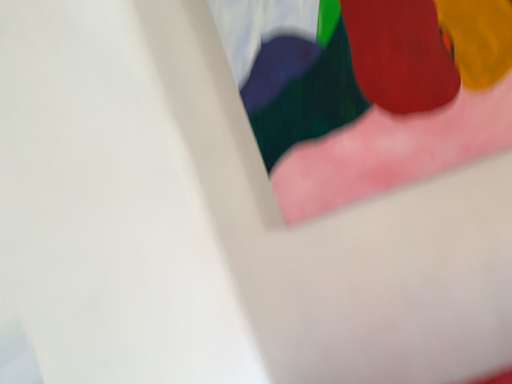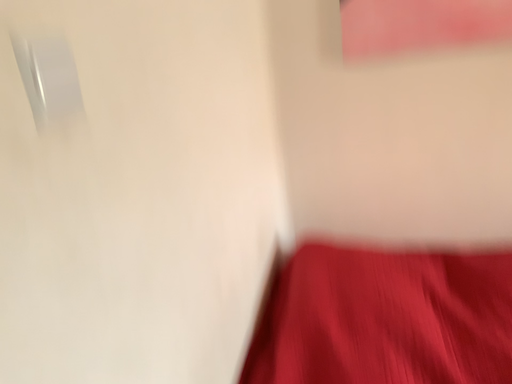
Question: Which way did the camera rotate in the video?

Choices:
 (A) rotated right
 (B) rotated left

Answer: (B)